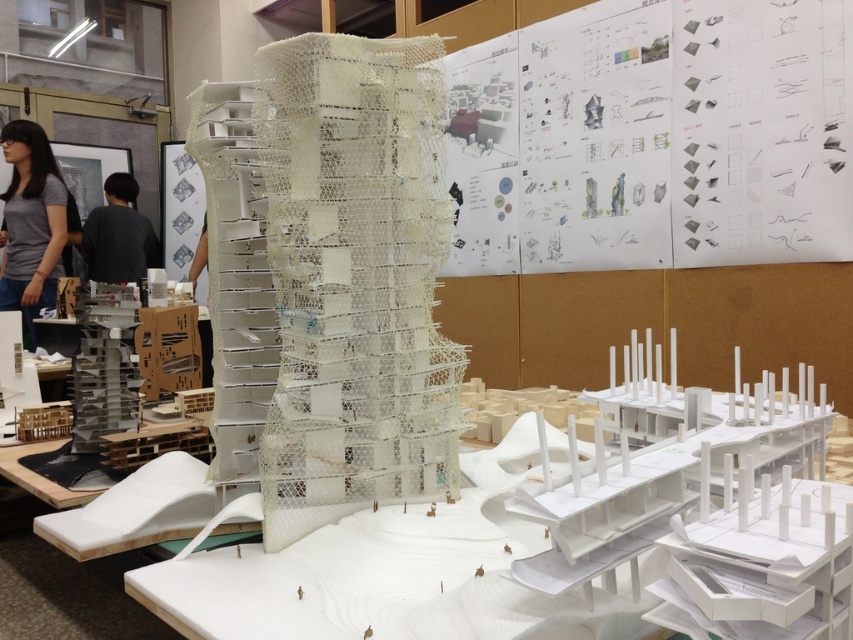
Measure the distance between gray matte shirt at left and camera.

gray matte shirt at left and camera are 4.15 meters apart.

Looking at this image, which is above, gray matte shirt at left or black shirt at left?

Positioned higher is black shirt at left.

Is point (20, 129) more distant than point (119, 182)?

No, it is not.

This screenshot has height=640, width=853. I want to click on gray matte shirt at left, so click(x=32, y=224).